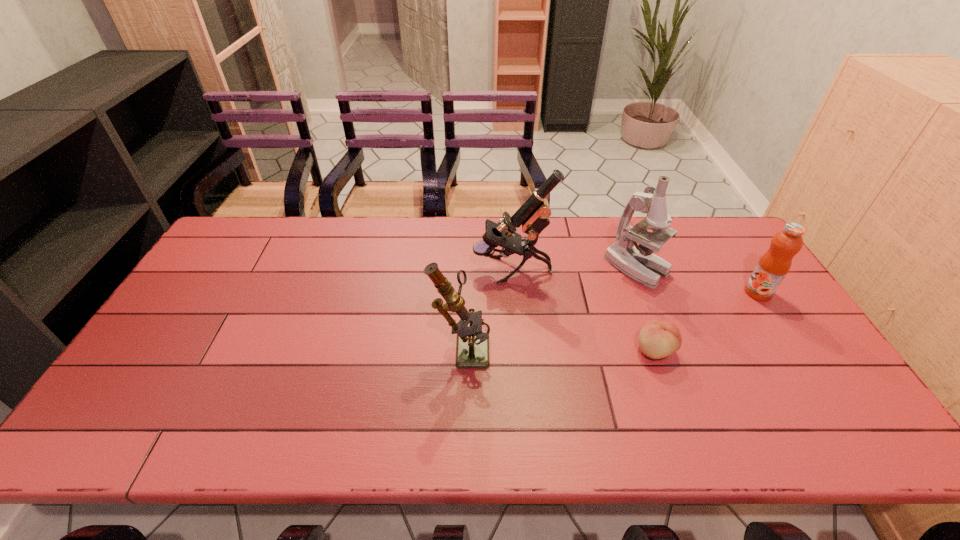
Image resolution: width=960 pixels, height=540 pixels. Find the location of `free space between the shortest object and the rightmost object`. free space between the shortest object and the rightmost object is located at coordinates (707, 321).

Identify the location of vacant space that is in between the peach and the nearest microscope. (558, 348).

The width and height of the screenshot is (960, 540). What are the coordinates of `vacant area that lies between the shortest object and the fruit juice` in the screenshot? It's located at (707, 321).

Select which object is the second closest to the rightmost object. Please provide its 2D coordinates. Your answer should be formatted as a tuple, i.e. [(x, y)], where the tuple contains the x and y coordinates of a point satisfying the conditions above.

[(659, 338)]

Choose which object is the nearest neighbor to the fruit juice. Please provide its 2D coordinates. Your answer should be formatted as a tuple, i.e. [(x, y)], where the tuple contains the x and y coordinates of a point satisfying the conditions above.

[(638, 262)]

What are the coordinates of `the closest microscope to the rightmost microscope` in the screenshot? It's located at (532, 216).

Find the location of a particular element. Image resolution: width=960 pixels, height=540 pixels. microscope that is the third closest to the fruit juice is located at coordinates tap(472, 349).

Identify the location of vacant space that satisfies the following two spatial constraints: 1. on the back side of the shortest object; 2. at the eyepiece of the nearest microscope. Image resolution: width=960 pixels, height=540 pixels. (653, 346).

The image size is (960, 540). What are the coordinates of `vacant space that satisfies the following two spatial constraints: 1. on the back side of the shortest object; 2. on the right side of the rightmost microscope` in the screenshot? It's located at (625, 268).